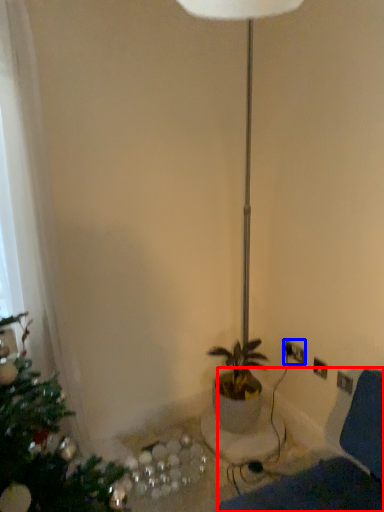
Question: Which object is further to the camera taking this photo, swivel chair (highlighted by a red box) or electric outlet (highlighted by a blue box)?

Choices:
 (A) swivel chair
 (B) electric outlet

Answer: (B)